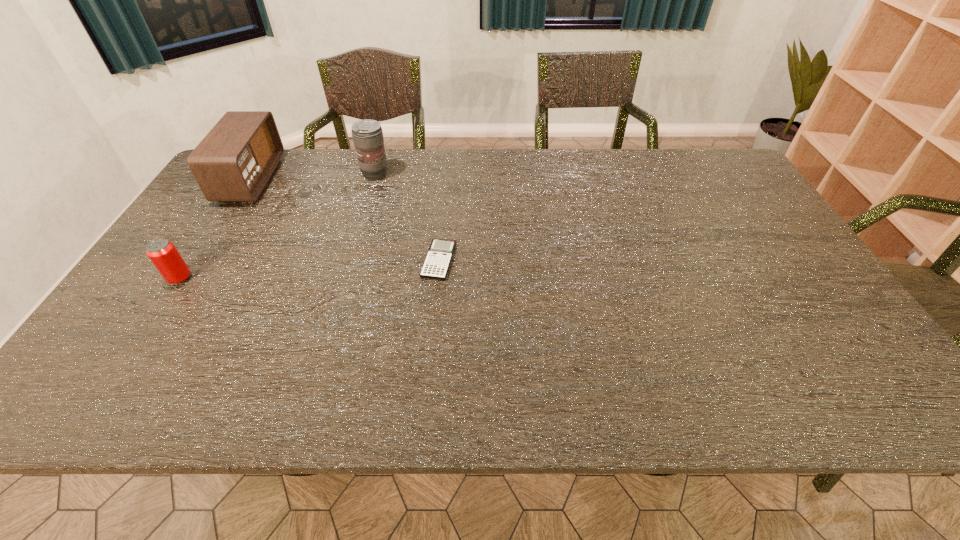
Where is `radio receiver at the far edge`? radio receiver at the far edge is located at coordinates (234, 161).

In order to click on radio receiver located in the left edge section of the desktop in this screenshot , I will do `click(234, 161)`.

At what (x,y) coordinates should I click in order to perform the action: click on can located in the left edge section of the desktop. Please return your answer as a coordinate pair (x, y). This screenshot has width=960, height=540. Looking at the image, I should click on (163, 254).

Where is `object situated at the far left corner`? object situated at the far left corner is located at coordinates (234, 161).

Identify the location of free space at the far edge of the desktop. The width and height of the screenshot is (960, 540). (619, 151).

You are a GUI agent. You are given a task and a screenshot of the screen. Output one action in this format:
    pyautogui.click(x=<x>, y=<y>)
    Task: Click on the blank space at the near edge of the desktop
    Image resolution: width=960 pixels, height=540 pixels.
    Given the screenshot: What is the action you would take?
    pyautogui.click(x=575, y=389)

Find the location of a particular element. Image resolution: width=960 pixels, height=540 pixels. vacant space at the left edge of the desktop is located at coordinates (126, 310).

Locate an element on the screen. The image size is (960, 540). vacant area at the right edge is located at coordinates (788, 346).

You are a GUI agent. You are given a task and a screenshot of the screen. Output one action in this format:
    pyautogui.click(x=<x>, y=<y>)
    Task: Click on the free region at the far left corner of the desktop
    The width and height of the screenshot is (960, 540).
    Given the screenshot: What is the action you would take?
    pyautogui.click(x=271, y=178)

This screenshot has width=960, height=540. Find the location of `free location at the near left corner`. free location at the near left corner is located at coordinates (151, 376).